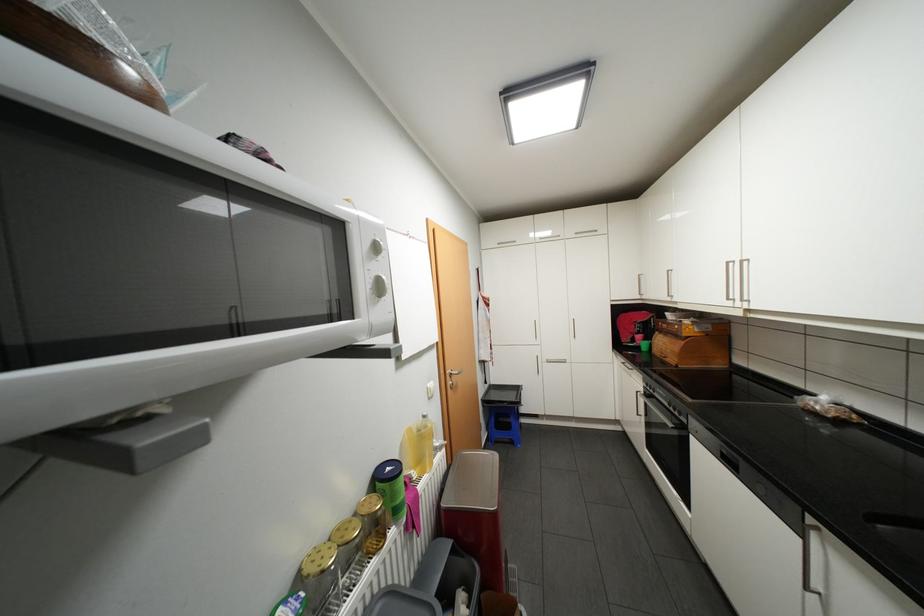
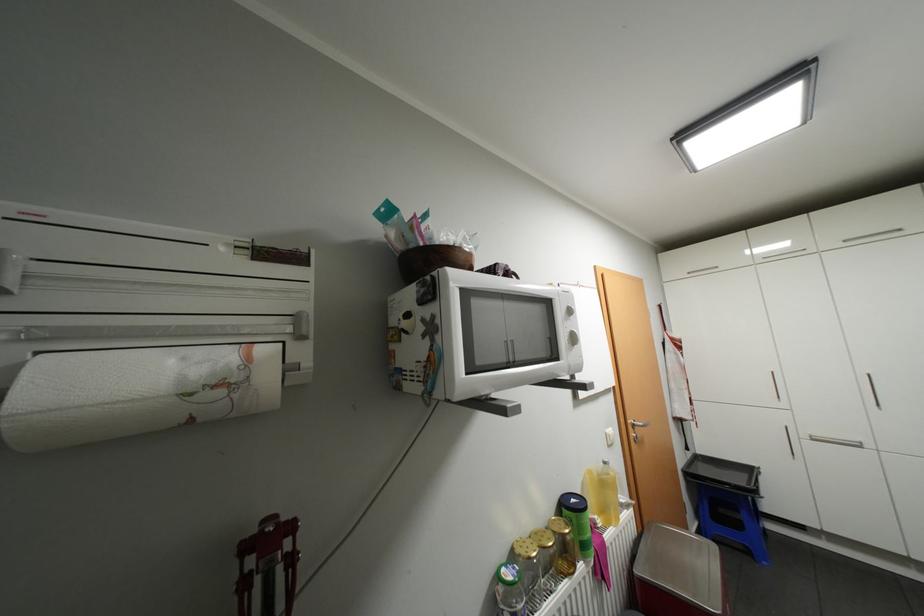
In the second image, find the point that corresponds to (x=518, y=442) in the first image.

(756, 552)